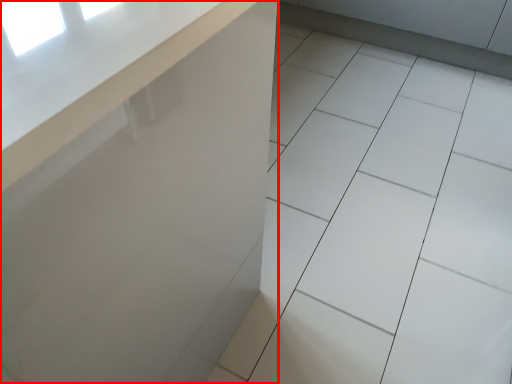
Question: Considering the relative positions of counter (annotated by the red box) and ceramic tile in the image provided, where is counter (annotated by the red box) located with respect to the staircase?

Choices:
 (A) right
 (B) left

Answer: (B)